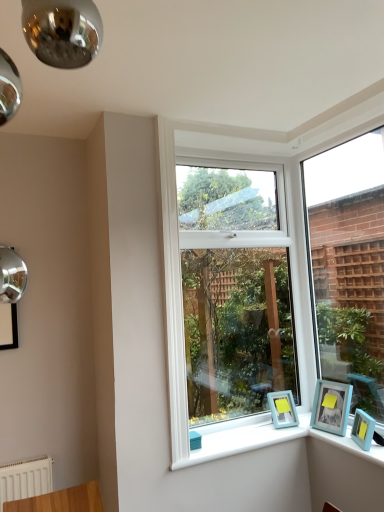
Question: Is light blue plastic picture frame at lower right, which ranks as the second picture frame in left-to-right order, positioned with its back to light blue plastic picture frame at lower right, the 3th picture frame viewed from the left?

Choices:
 (A) yes
 (B) no

Answer: (B)

Question: Is light blue plastic picture frame at lower right, the second picture frame viewed from the right, positioned beyond the bounds of light blue plastic picture frame at lower right, the 3th picture frame viewed from the left?

Choices:
 (A) yes
 (B) no

Answer: (A)

Question: Considering the relative sizes of light blue plastic picture frame at lower right, which ranks as the second picture frame in left-to-right order, and light blue plastic picture frame at lower right, the 3th picture frame viewed from the left, in the image provided, is light blue plastic picture frame at lower right, which ranks as the second picture frame in left-to-right order, shorter than light blue plastic picture frame at lower right, the 3th picture frame viewed from the left,?

Choices:
 (A) yes
 (B) no

Answer: (B)

Question: From the image's perspective, is light blue plastic picture frame at lower right, the second picture frame viewed from the right, on top of light blue plastic picture frame at lower right, the 3th picture frame viewed from the left?

Choices:
 (A) yes
 (B) no

Answer: (A)

Question: Is light blue plastic picture frame at lower right, which ranks as the second picture frame in left-to-right order, to the left of light blue plastic picture frame at lower right, the 3th picture frame viewed from the left, from the viewer's perspective?

Choices:
 (A) yes
 (B) no

Answer: (A)

Question: From the image's perspective, relative to light blue plastic picture frame at lower right, which ranks as the second picture frame in left-to-right order, is white plastic window at center, placed as the 2th window when sorted from right to left, above or below?

Choices:
 (A) above
 (B) below

Answer: (A)

Question: From a real-world perspective, is white plastic window at center, placed as the 2th window when sorted from right to left, above or below light blue plastic picture frame at lower right, which ranks as the second picture frame in left-to-right order?

Choices:
 (A) below
 (B) above

Answer: (B)

Question: Relative to light blue plastic picture frame at lower right, which ranks as the second picture frame in left-to-right order, is white plastic window at center, placed as the 2th window when sorted from right to left, in front or behind?

Choices:
 (A) behind
 (B) front

Answer: (A)

Question: Is white plastic window at center, placed as the 2th window when sorted from right to left, bigger or smaller than light blue plastic picture frame at lower right, the second picture frame viewed from the right?

Choices:
 (A) small
 (B) big

Answer: (B)

Question: Is teal matte picture frame at lower right, which appears as the third picture frame when viewed from the right, inside or outside of white plastic window at center, arranged as the 1th window when viewed from the left?

Choices:
 (A) outside
 (B) inside

Answer: (A)

Question: In terms of height, does teal matte picture frame at lower right, the 1th picture frame positioned from the left, look taller or shorter compared to white plastic window at center, arranged as the 1th window when viewed from the left?

Choices:
 (A) short
 (B) tall

Answer: (A)

Question: Relative to white plastic window at center, placed as the 2th window when sorted from right to left, is teal matte picture frame at lower right, the 1th picture frame positioned from the left, in front or behind?

Choices:
 (A) front
 (B) behind

Answer: (B)

Question: In the image, is teal matte picture frame at lower right, which appears as the third picture frame when viewed from the right, on the left side or the right side of white plastic window at center, arranged as the 1th window when viewed from the left?

Choices:
 (A) left
 (B) right

Answer: (B)

Question: In terms of width, does clear glass window at right, arranged as the second window when viewed from the left, look wider or thinner when compared to light blue plastic picture frame at lower right, which ranks as the second picture frame in left-to-right order?

Choices:
 (A) thin
 (B) wide

Answer: (A)

Question: Is point (321, 357) closer or farther from the camera than point (319, 391)?

Choices:
 (A) closer
 (B) farther

Answer: (B)